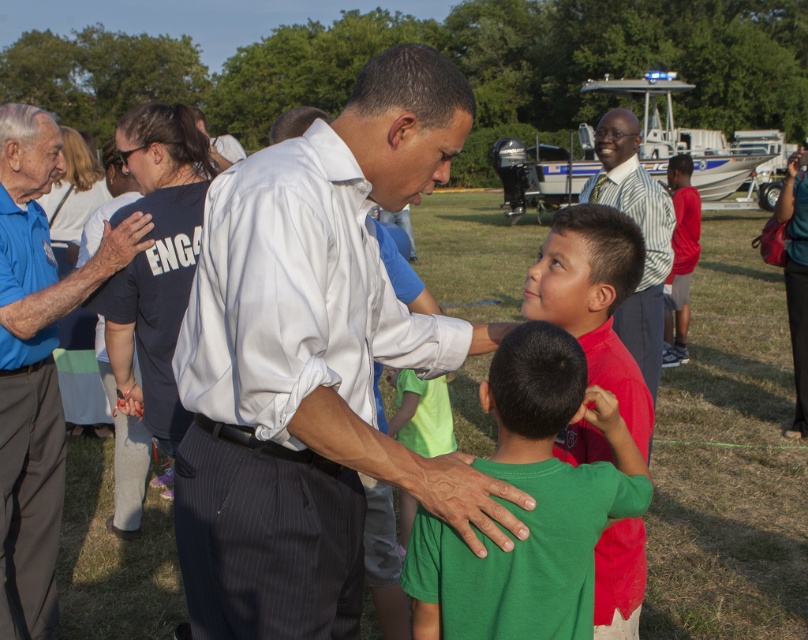
You are organizing a clothing drive and need to pack shirts into boxes. The box you have can only fit shirts narrower than 30 cm in width. You see the green matte shirt at center and the blue shirt at left. Based on their widths, which shirts can be placed into the box?

The green matte shirt at center has a width less than the blue shirt at left. Since the box can only fit shirts narrower than 30 cm, only the green matte shirt at center can be placed into the box if its width is under 30 cm. However, without knowing the exact width of the blue shirt, we can only confirm the green one qualifies based on relative size.

In the scene, there are two men wearing a blue shirt at left and a striped shirt at center. Which one is taller?

The blue shirt at left is taller than striped shirt at center.